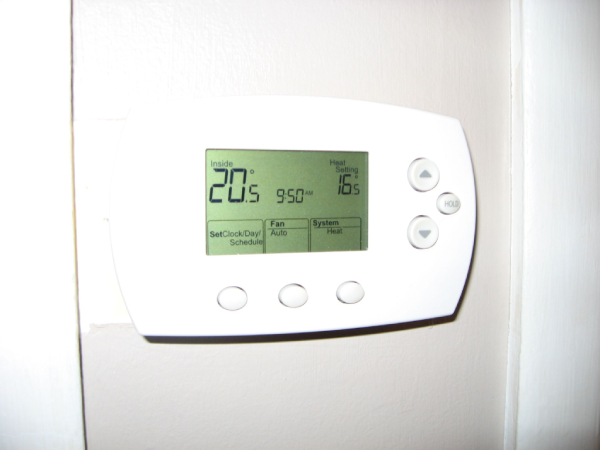
Find the location of a particular element. The image size is (600, 450). display screen is located at coordinates coord(310,175).